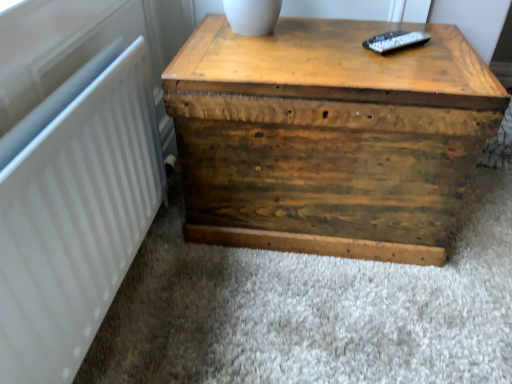
Question: Does wooden trunk at center have a smaller size compared to white matte radiator at left?

Choices:
 (A) yes
 (B) no

Answer: (B)

Question: From a real-world perspective, is wooden trunk at center below white matte radiator at left?

Choices:
 (A) yes
 (B) no

Answer: (A)

Question: Can we say wooden trunk at center lies outside white matte radiator at left?

Choices:
 (A) no
 (B) yes

Answer: (B)

Question: Considering the relative positions of wooden trunk at center and white matte radiator at left in the image provided, is wooden trunk at center behind white matte radiator at left?

Choices:
 (A) yes
 (B) no

Answer: (A)

Question: Considering the relative positions of wooden trunk at center and white matte radiator at left in the image provided, is wooden trunk at center to the left of white matte radiator at left from the viewer's perspective?

Choices:
 (A) yes
 (B) no

Answer: (B)

Question: Is wooden trunk at center shorter than white matte radiator at left?

Choices:
 (A) yes
 (B) no

Answer: (B)

Question: Considering the relative positions of white matte radiator at left and wooden trunk at center in the image provided, is white matte radiator at left to the right of wooden trunk at center from the viewer's perspective?

Choices:
 (A) yes
 (B) no

Answer: (B)

Question: From a real-world perspective, is white matte radiator at left below wooden trunk at center?

Choices:
 (A) yes
 (B) no

Answer: (B)

Question: From the image's perspective, is white matte radiator at left located beneath wooden trunk at center?

Choices:
 (A) yes
 (B) no

Answer: (A)

Question: Is white matte radiator at left positioned beyond the bounds of wooden trunk at center?

Choices:
 (A) no
 (B) yes

Answer: (B)

Question: From a real-world perspective, is white matte radiator at left located higher than wooden trunk at center?

Choices:
 (A) no
 (B) yes

Answer: (B)

Question: Is white matte radiator at left to the left of wooden trunk at center from the viewer's perspective?

Choices:
 (A) no
 (B) yes

Answer: (B)

Question: In the image, is white matte radiator at left positioned in front of or behind wooden trunk at center?

Choices:
 (A) front
 (B) behind

Answer: (A)